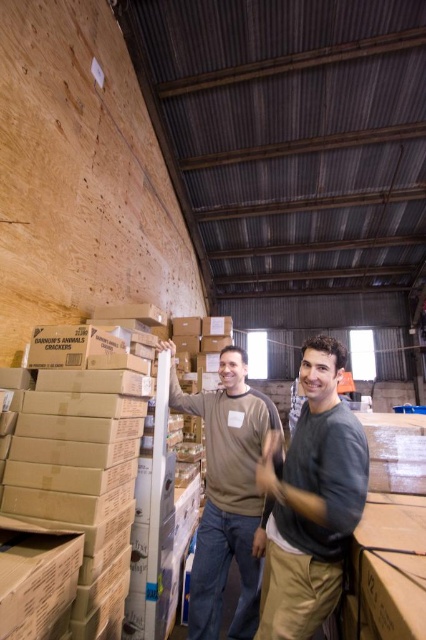
Is dark gray cotton shirt at center above brown cotton shirt at center?

Indeed, dark gray cotton shirt at center is positioned over brown cotton shirt at center.

Who is positioned more to the right, dark gray cotton shirt at center or brown cotton shirt at center?

Positioned to the right is dark gray cotton shirt at center.

Find the location of `dark gray cotton shirt at center`. dark gray cotton shirt at center is located at coordinates (311, 500).

In order to click on dark gray cotton shirt at center in this screenshot , I will do `click(311, 500)`.